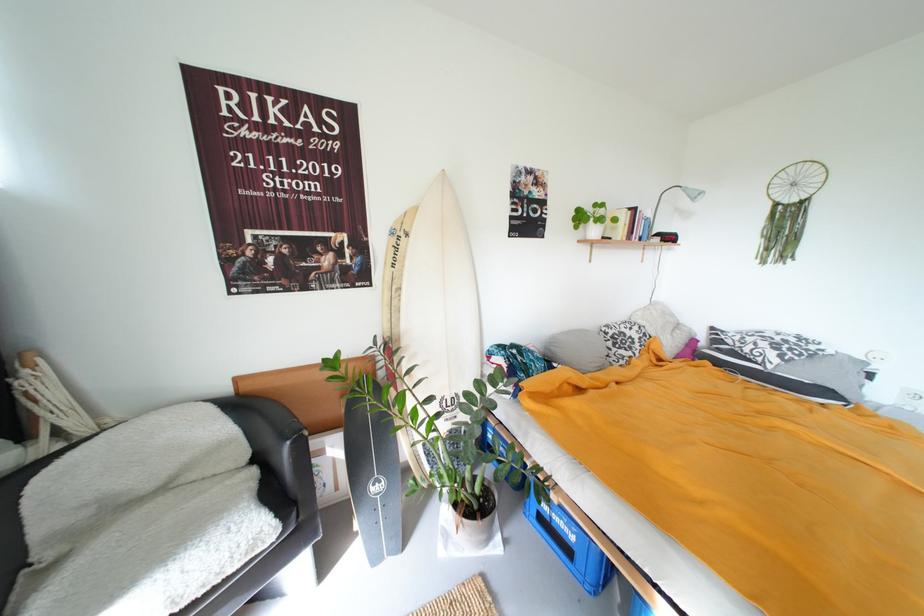
Locate an element on the screen. Image resolution: width=924 pixels, height=616 pixels. black chair armrest is located at coordinates (275, 444).